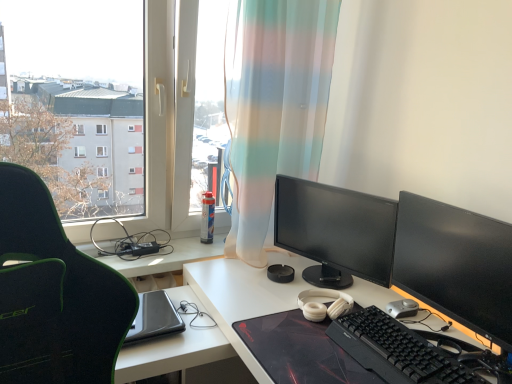
You are a GUI agent. You are given a task and a screenshot of the screen. Output one action in this format:
    pyautogui.click(x=<x>, y=<y>)
    Task: Click on the free space that is in between matte black monitor at center, positioned as the 2th computer monitor in front-to-back order, and silver metallic mouse at lower right
    
    Given the screenshot: What is the action you would take?
    pyautogui.click(x=400, y=301)